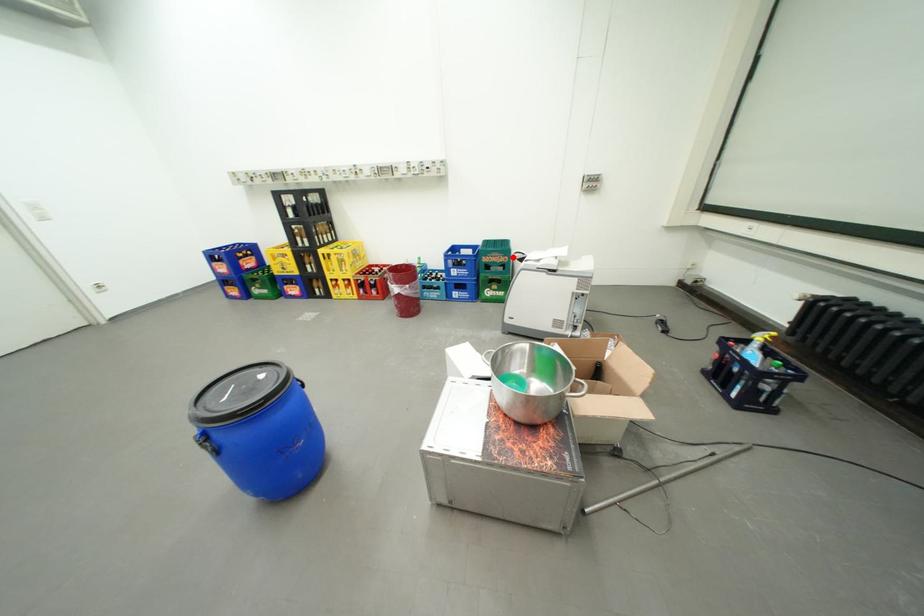
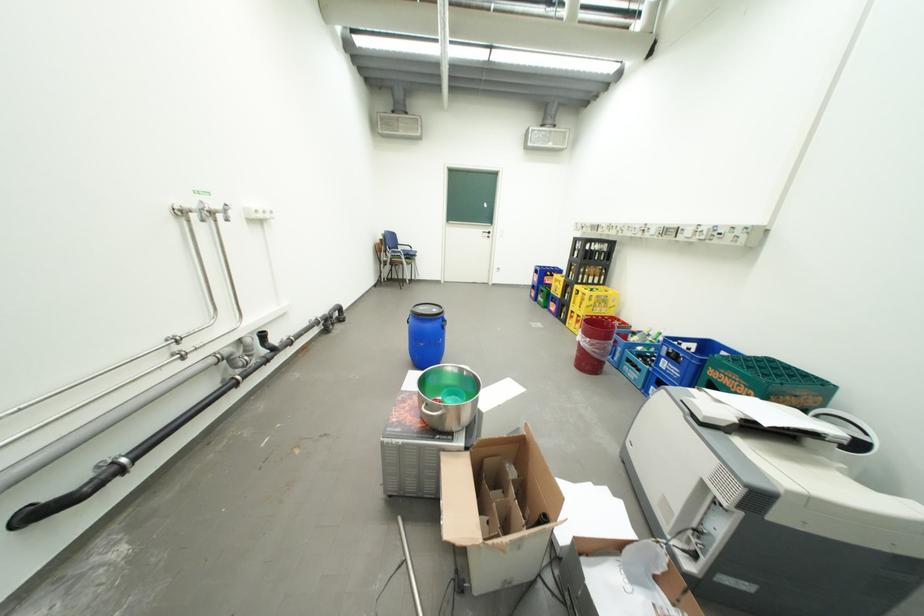
Where in the second image is the point corresponding to the highlighted location from the first image?

(756, 387)